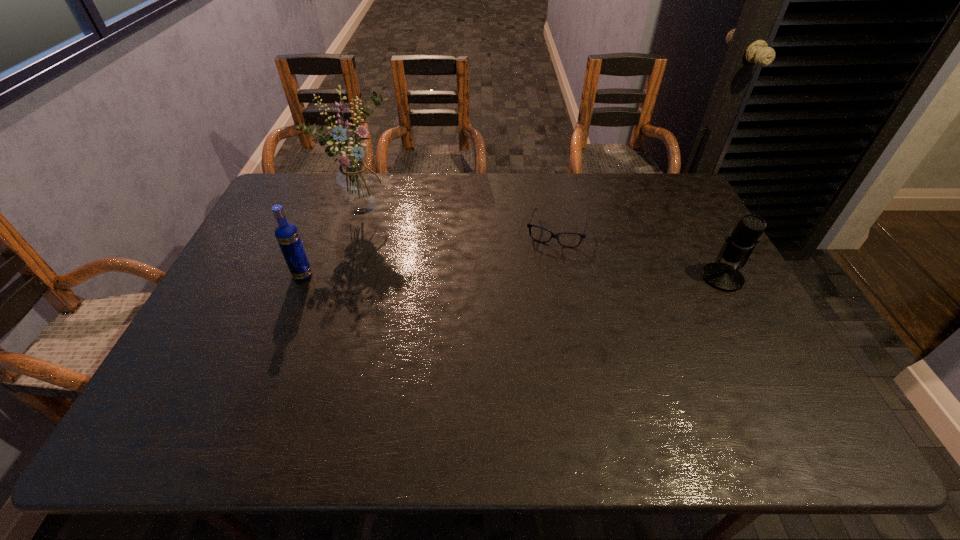
Identify the location of vacant area between the bouquet and the spectacles. (460, 220).

Image resolution: width=960 pixels, height=540 pixels. Find the location of `object identified as the closest to the spectacles`. object identified as the closest to the spectacles is located at coordinates (738, 246).

The width and height of the screenshot is (960, 540). Find the location of `the third closest object to the microphone`. the third closest object to the microphone is located at coordinates [287, 235].

This screenshot has height=540, width=960. I want to click on vacant region that satisfies the following two spatial constraints: 1. on the front side of the rightmost object; 2. on the right side of the spectacles, so click(x=566, y=278).